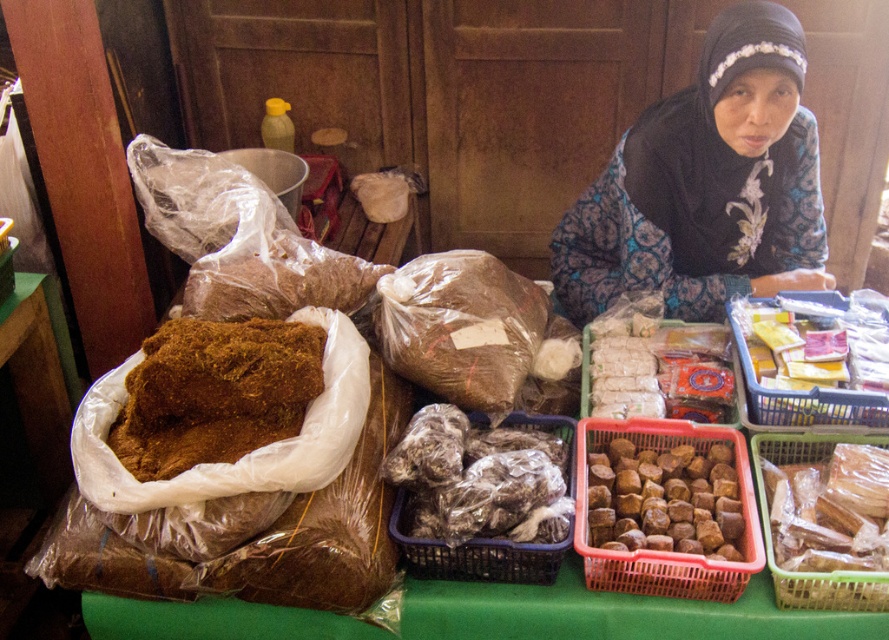
Question: Which of the following is the closest to the observer?

Choices:
 (A) translucent plastic basket at lower right
 (B) yellow paper at upper right
 (C) translucent plastic basket at center
 (D) brown crumbly food at left

Answer: (A)

Question: Observing the image, what is the correct spatial positioning of translucent plastic basket at lower right in reference to yellow paper at upper right?

Choices:
 (A) right
 (B) left

Answer: (B)

Question: Which is farther from the yellow paper at upper right?

Choices:
 (A) brown crumbly food at left
 (B) black batik hijab at upper center
 (C) white paper wrapped at center
 (D) translucent plastic basket at lower right

Answer: (A)

Question: Among these objects, which one is farthest from the camera?

Choices:
 (A) translucent plastic basket at lower right
 (B) brown crumbly food at left

Answer: (B)

Question: Does brown crumbly food at left appear on the right side of brown woven basket at center?

Choices:
 (A) no
 (B) yes

Answer: (A)

Question: Is brown woven basket at center closer to the viewer compared to yellow paper at upper right?

Choices:
 (A) no
 (B) yes

Answer: (B)